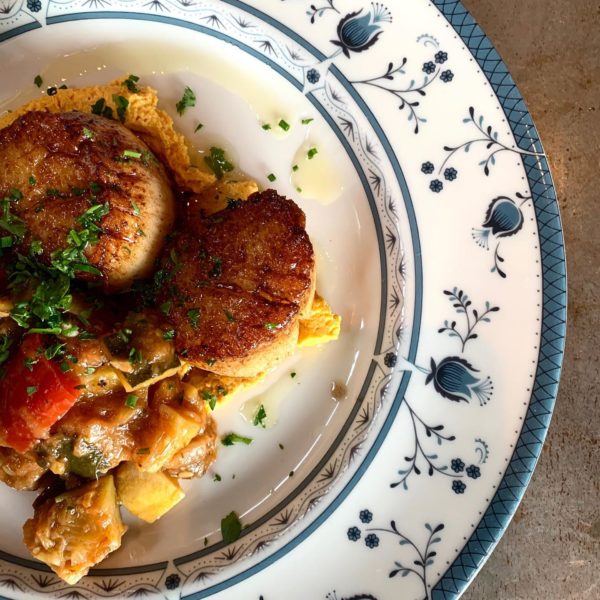
Where is `table`? The image size is (600, 600). table is located at coordinates click(x=502, y=21).